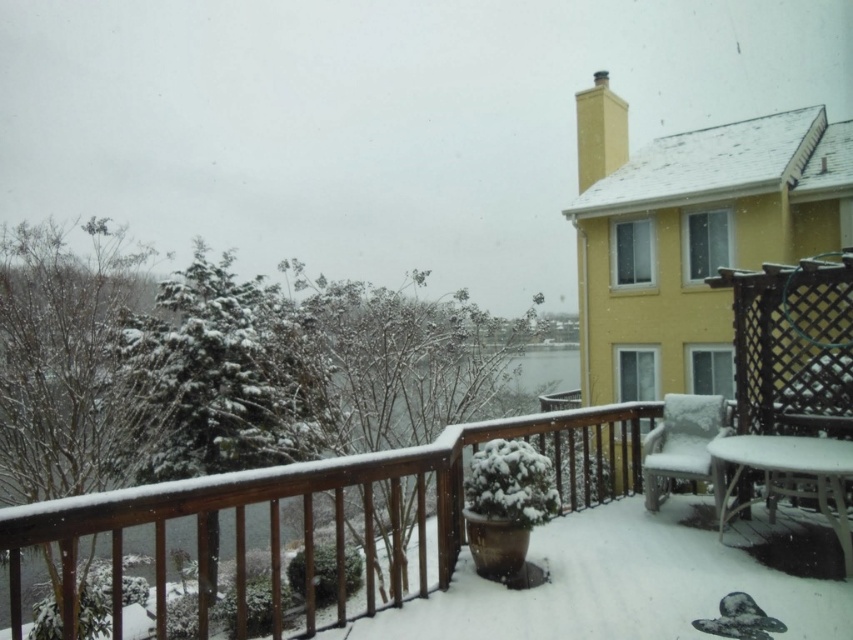
Is point (811, 436) farther from camera compared to point (804, 442)?

That is True.

Which is behind, point (404, 470) or point (845, 470)?

Positioned behind is point (845, 470).

What do you see at coordinates (312, 513) in the screenshot? This screenshot has height=640, width=853. I see `snow-covered wooden porch at center` at bounding box center [312, 513].

You are a GUI agent. You are given a task and a screenshot of the screen. Output one action in this format:
    pyautogui.click(x=<x>, y=<y>)
    Task: Click on the snow-covered wooden porch at center
    This screenshot has height=640, width=853.
    Given the screenshot: What is the action you would take?
    pyautogui.click(x=312, y=513)

Between snow-covered wooden porch at center and white fluffy chair at lower right, which one has less height?

With less height is white fluffy chair at lower right.

Locate an element on the screen. The width and height of the screenshot is (853, 640). snow-covered wooden porch at center is located at coordinates (312, 513).

Who is positioned more to the left, white glossy table at lower right or white fluffy chair at lower right?

white fluffy chair at lower right

Is white glossy table at lower right positioned behind white fluffy chair at lower right?

That is False.

Is point (851, 474) closer to camera compared to point (701, 480)?

Yes, it is in front of point (701, 480).

In order to click on white glossy table at lower right in this screenshot , I will do `click(790, 476)`.